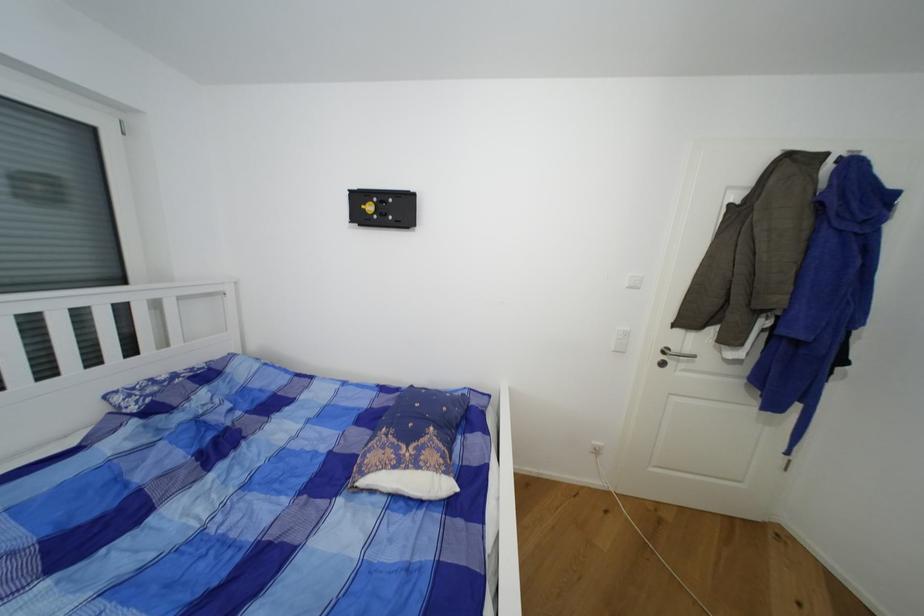
The width and height of the screenshot is (924, 616). Describe the element at coordinates (673, 355) in the screenshot. I see `the metal door handle` at that location.